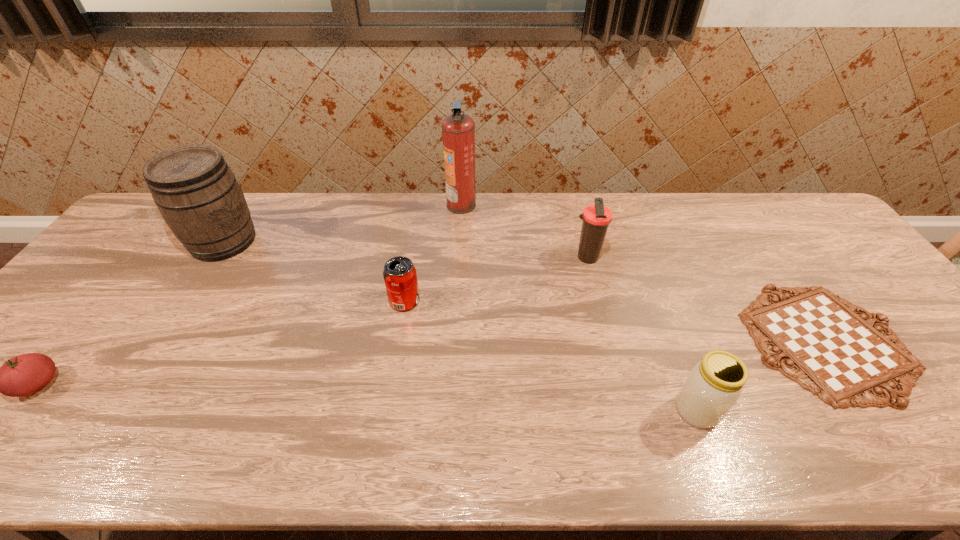
Find the location of a particular element. object situated at the near edge is located at coordinates (715, 383).

I want to click on object that is at the right edge, so click(x=841, y=357).

This screenshot has height=540, width=960. In order to click on vacant space at the far edge of the desktop in this screenshot , I will do `click(257, 235)`.

This screenshot has width=960, height=540. I want to click on free space at the near edge of the desktop, so pos(941,449).

I want to click on vacant space at the right edge of the desktop, so click(x=932, y=403).

The width and height of the screenshot is (960, 540). In order to click on vacant area at the near right corner in this screenshot , I will do `click(956, 455)`.

You are a GUI agent. You are given a task and a screenshot of the screen. Output one action in this format:
    pyautogui.click(x=<x>, y=<y>)
    Task: Click on the empty location between the fourth shortest object and the third tallest object
    Image resolution: width=960 pixels, height=540 pixels.
    Given the screenshot: What is the action you would take?
    click(641, 334)

Where is `free spot between the fifth object from right to left and the fourth shortest object`? free spot between the fifth object from right to left and the fourth shortest object is located at coordinates (551, 356).

Where is `free space between the third object from right to left and the rightmost object`? The width and height of the screenshot is (960, 540). free space between the third object from right to left and the rightmost object is located at coordinates (707, 299).

Image resolution: width=960 pixels, height=540 pixels. What are the coordinates of `empty space that is in between the shortest object and the second object from left to right` in the screenshot? It's located at (525, 291).